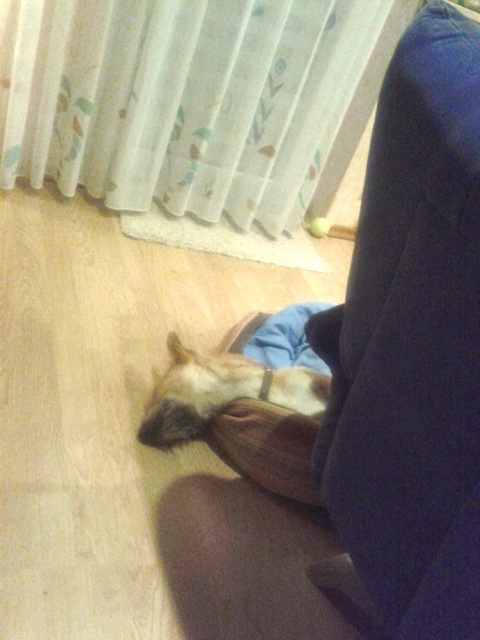
Can you confirm if fuzzy brown dog at lower center is positioned below brown fabric pillow at lower center?

Incorrect, fuzzy brown dog at lower center is not positioned below brown fabric pillow at lower center.

Is fuzzy brown dog at lower center closer to the viewer compared to brown fabric pillow at lower center?

No, fuzzy brown dog at lower center is behind brown fabric pillow at lower center.

Between point (244, 385) and point (305, 460), which one is positioned behind?

The point (244, 385) is behind.

Locate an element on the screen. fuzzy brown dog at lower center is located at coordinates (222, 392).

Is white sheer curtain at upper center positioned behind brown fabric pillow at lower center?

Yes.

Does point (224, 58) come behind point (294, 442)?

That is True.

Who is more distant from viewer, (302, 40) or (307, 477)?

Point (302, 40)

At what (x,y) coordinates should I click in order to perform the action: click on white sheer curtain at upper center. Please return your answer as a coordinate pair (x, y). The height and width of the screenshot is (640, 480). Looking at the image, I should click on (192, 100).

Can you confirm if white sheer curtain at upper center is shorter than fuzzy brown dog at lower center?

Incorrect, white sheer curtain at upper center's height does not fall short of fuzzy brown dog at lower center's.

Does white sheer curtain at upper center have a lesser width compared to fuzzy brown dog at lower center?

No, white sheer curtain at upper center is not thinner than fuzzy brown dog at lower center.

Does point (168, 168) come in front of point (191, 356)?

No, it is not.

I want to click on white sheer curtain at upper center, so click(192, 100).